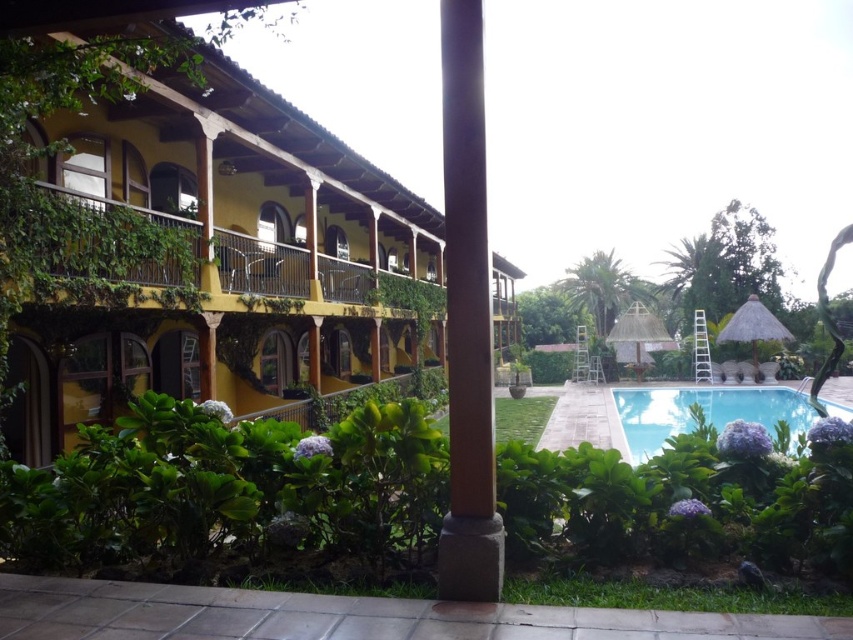
You are designing a garden layout and need to place a 3m wide statue between the green leafy bush at center and the brown stone pillar at center. Can the space between them accommodate the statue?

The green leafy bush at center is wider than the brown stone pillar at center, but the exact distance between them isn

You are standing on the paved walkway and want to see the clear blue water at center. Which direction should you look to avoid the green leafy bush at center blocking your view?

The green leafy bush at center is above the clear blue water at center, so you should look downward to avoid the bush blocking your view.